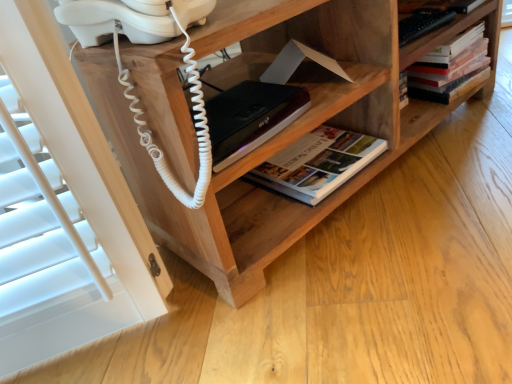
Question: In terms of width, does wooden shelf at center look wider or thinner when compared to hardcover book at upper right, the first book from the right?

Choices:
 (A) wide
 (B) thin

Answer: (A)

Question: Considering the positions of point (254, 200) and point (431, 72), is point (254, 200) closer or farther from the camera than point (431, 72)?

Choices:
 (A) farther
 (B) closer

Answer: (B)

Question: Which object is the farthest from the hardcover book at upper right, the 2th book in the left-to-right sequence?

Choices:
 (A) hardcover book at center, the first book positioned from the left
 (B) wooden shelf at center
 (C) black matte book at center

Answer: (C)

Question: Estimate the real-world distances between objects in this image. Which object is closer to the hardcover book at upper right, which is counted as the first book, starting from the top?

Choices:
 (A) wooden shelf at center
 (B) black matte book at center
 (C) hardcover book at center, the first book positioned from the left

Answer: (C)